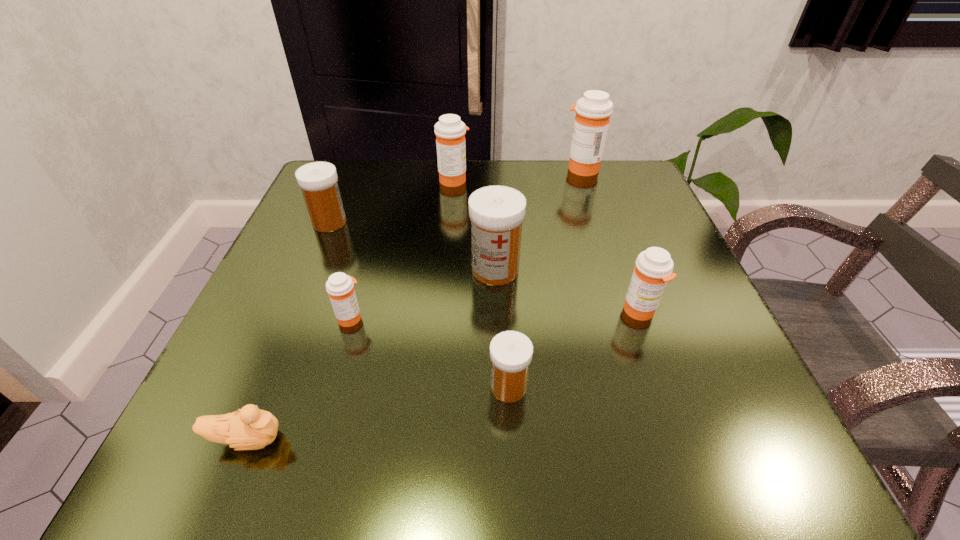
You are a GUI agent. You are given a task and a screenshot of the screen. Output one action in this format:
    pyautogui.click(x=<x>, y=<y>)
    Task: Click on the free area in between the seventh farthest object and the second orange medicine from left to right
    
    Given the screenshot: What is the action you would take?
    pyautogui.click(x=481, y=283)

Where is `vacant area that lies between the nearest object and the biggest white medicine`? vacant area that lies between the nearest object and the biggest white medicine is located at coordinates (372, 355).

What are the coordinates of `vacant point located between the fifth medicine from right to left and the third biggest orange medicine` in the screenshot? It's located at (547, 245).

This screenshot has height=540, width=960. Identify the location of vacant area that lies between the second farthest white medicine and the smallest white medicine. (502, 328).

The image size is (960, 540). Find the location of `vacant area that lies between the third biggest orange medicine and the third smallest orange medicine`. vacant area that lies between the third biggest orange medicine and the third smallest orange medicine is located at coordinates (547, 245).

Locate which object is the fourth closest to the tallest object. Please provide its 2D coordinates. Your answer should be formatted as a tuple, i.e. [(x, y)], where the tuple contains the x and y coordinates of a point satisfying the conditions above.

[(318, 180)]

Locate which object ranks fifth in proximity to the sixth medicine from right to left. Please provide its 2D coordinates. Your answer should be formatted as a tuple, i.e. [(x, y)], where the tuple contains the x and y coordinates of a point satisfying the conditions above.

[(450, 131)]

Point out which medicine is positioned as the third nearest to the biggest orange medicine. Please provide its 2D coordinates. Your answer should be formatted as a tuple, i.e. [(x, y)], where the tuple contains the x and y coordinates of a point satisfying the conditions above.

[(653, 269)]

Where is `the fifth closest medicine to the fifth object from right to left`? the fifth closest medicine to the fifth object from right to left is located at coordinates (653, 269).

At what (x,y) coordinates should I click in order to perform the action: click on the closest orange medicine to the second smallest orange medicine. Please return your answer as a coordinate pair (x, y). Looking at the image, I should click on (593, 111).